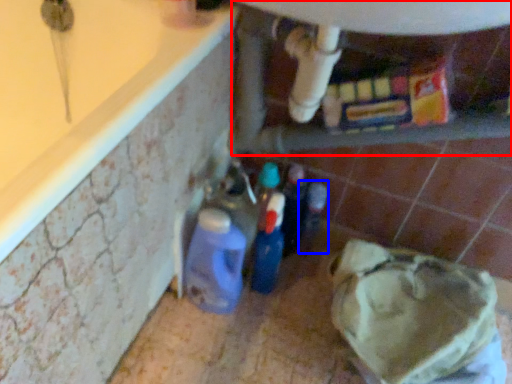
Question: Which point is closer to the camera, water heater (highlighted by a red box) or bottle (highlighted by a blue box)?

Choices:
 (A) water heater
 (B) bottle

Answer: (A)